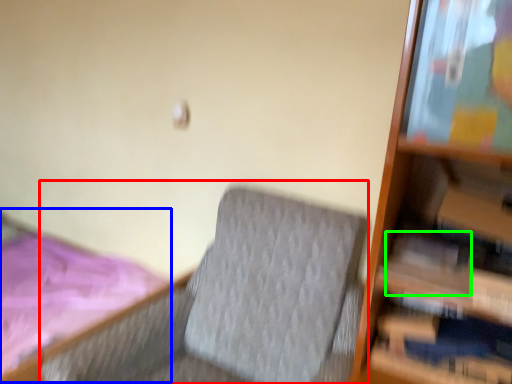
Question: Which object is the farthest from rocking chair (highlighted by a red box)? Choose among these: bed (highlighted by a blue box) or paperback book (highlighted by a green box).

Choices:
 (A) bed
 (B) paperback book

Answer: (A)